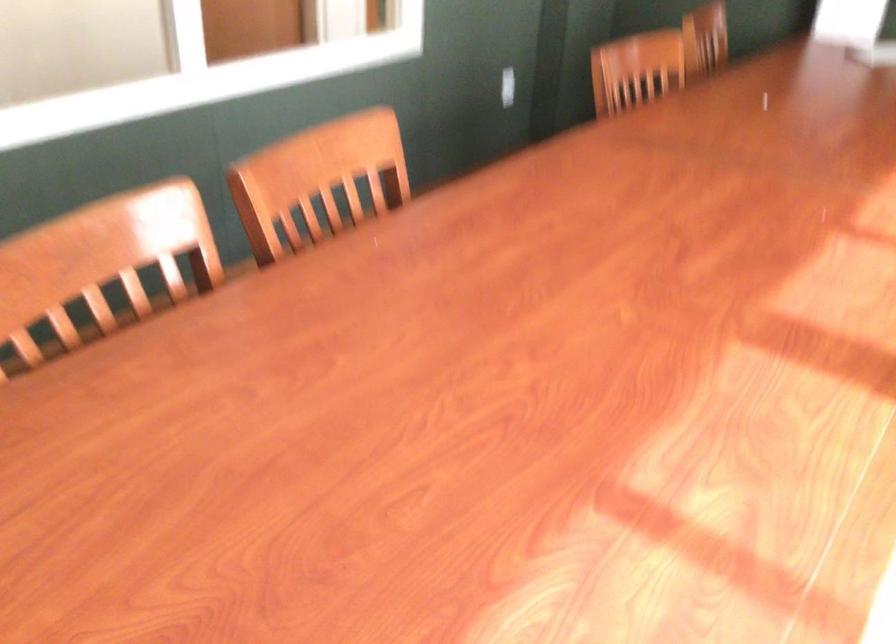
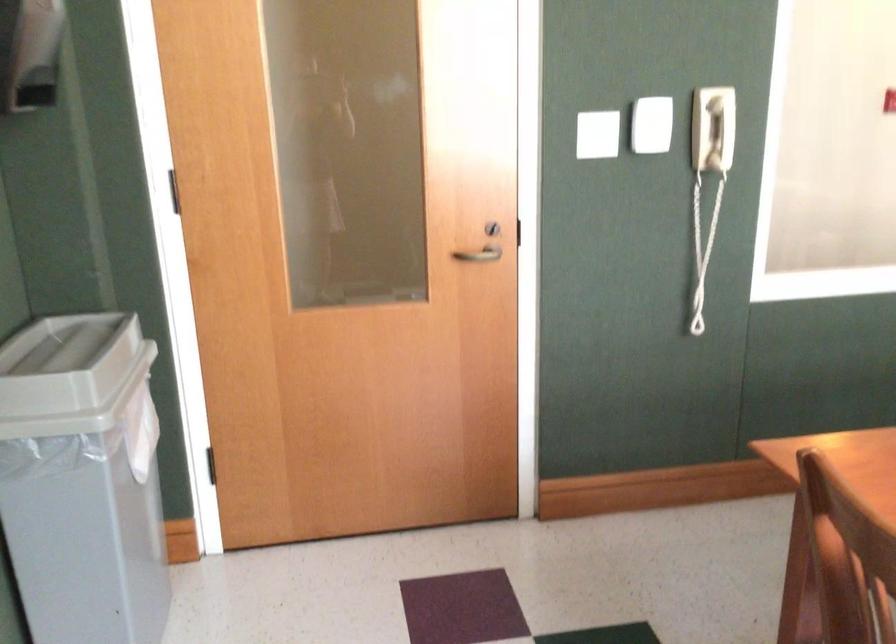
Question: The camera is either moving clockwise (left) or counter-clockwise (right) around the object. The first image is from the beginning of the video and the second image is from the end. Is the camera moving left or right when shooting the video?

Choices:
 (A) Left
 (B) Right

Answer: (B)